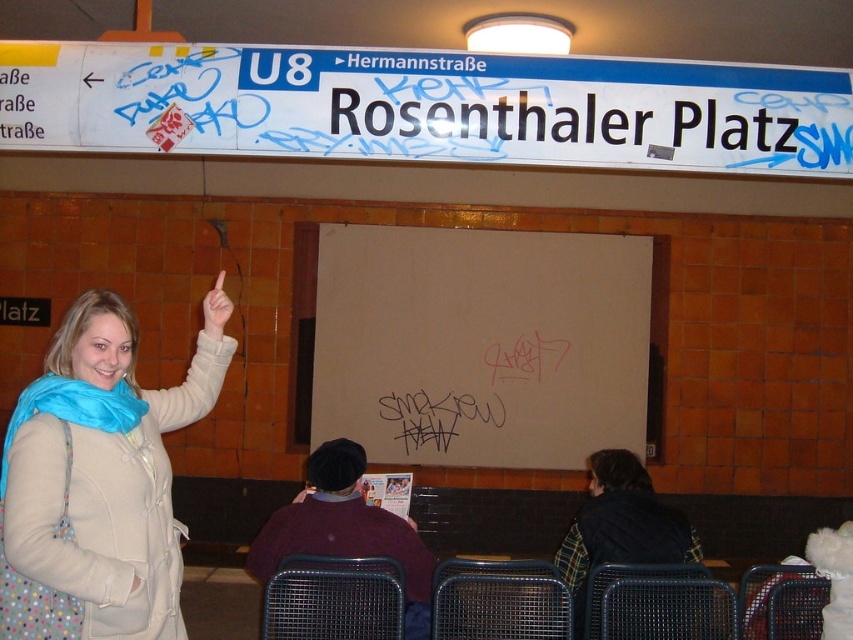
The height and width of the screenshot is (640, 853). What do you see at coordinates (106, 477) in the screenshot? I see `beige fabric coat at upper left` at bounding box center [106, 477].

Between beige fabric coat at upper left and white matte finger at upper center, which one appears on the right side from the viewer's perspective?

white matte finger at upper center

Where is `beige fabric coat at upper left`? beige fabric coat at upper left is located at coordinates (106, 477).

I want to click on beige fabric coat at upper left, so click(x=106, y=477).

Does white matte board at center come behind black marker graffiti at center?

That is False.

Can you confirm if white matte board at center is wider than black marker graffiti at center?

Correct, the width of white matte board at center exceeds that of black marker graffiti at center.

What are the coordinates of `white matte board at center` in the screenshot? It's located at (480, 344).

Consider the image. Who is more forward, (442, 448) or (207, 300)?

Point (207, 300) is in front.

Does black marker graffiti at center have a larger size compared to white matte finger at upper center?

Incorrect, black marker graffiti at center is not larger than white matte finger at upper center.

Identify the location of black marker graffiti at center. The image size is (853, 640). (436, 417).

Image resolution: width=853 pixels, height=640 pixels. Identify the location of black marker graffiti at center. pyautogui.click(x=436, y=417).